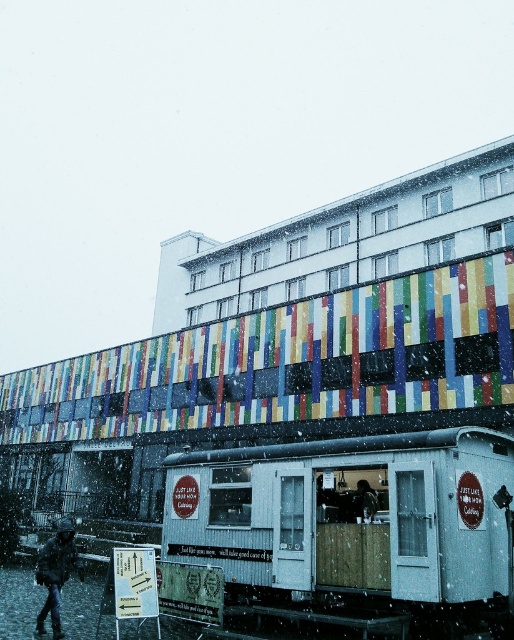
Question: Which point is closer to the camera?

Choices:
 (A) dark green textured coat at lower left
 (B) metallic silver trailer at center

Answer: (A)

Question: Which of these objects is positioned farthest from the dark green textured coat at lower left?

Choices:
 (A) metallic silver trailer at center
 (B) dark blue jacket at center

Answer: (B)

Question: Which point is farther to the camera?

Choices:
 (A) (43, 552)
 (B) (302, 593)
 (C) (365, 509)

Answer: (C)

Question: Is dark green textured coat at lower left to the right of dark blue jacket at center from the viewer's perspective?

Choices:
 (A) yes
 (B) no

Answer: (B)

Question: Can you confirm if dark green textured coat at lower left is thinner than dark blue jacket at center?

Choices:
 (A) yes
 (B) no

Answer: (B)

Question: Is dark green textured coat at lower left smaller than dark blue jacket at center?

Choices:
 (A) yes
 (B) no

Answer: (B)